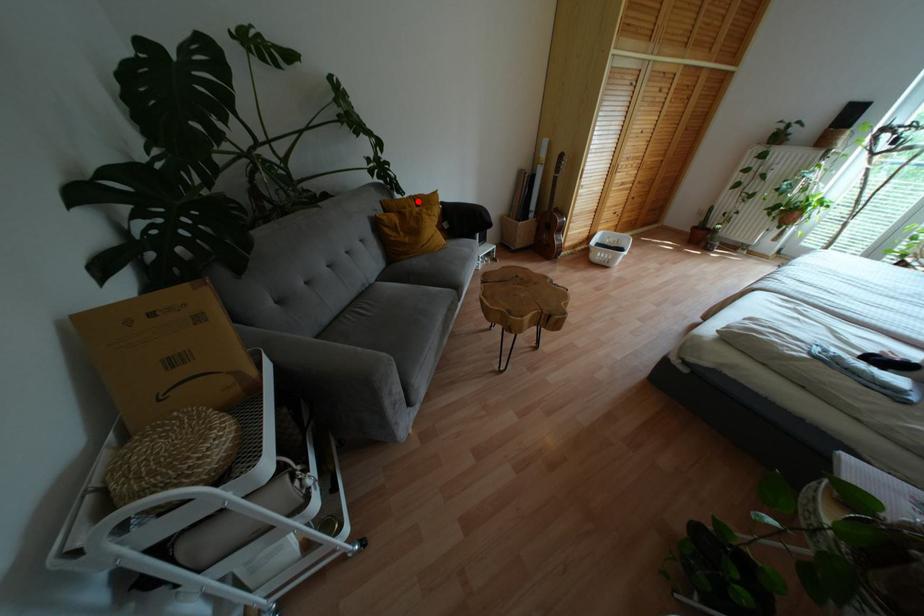
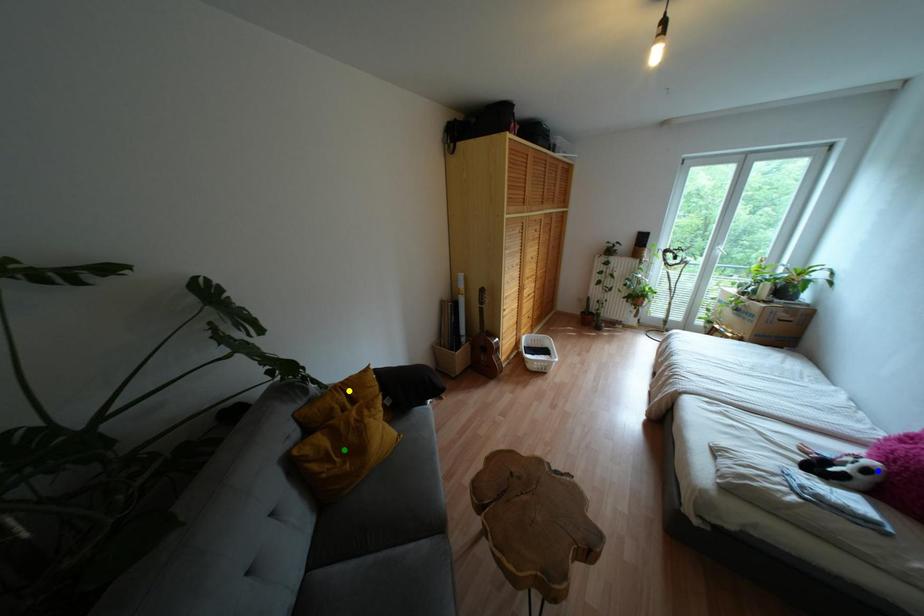
Question: I am providing you with two images of the same scene from different viewpoints. A red point is marked on the first image. You are given multiple points on the second image. Can you choose the point in image 2 that corresponds to the point in image 1?

Choices:
 (A) blue point
 (B) green point
 (C) yellow point

Answer: (C)